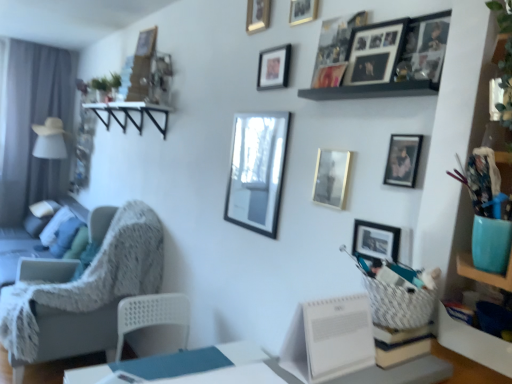
Where is `empty space that is ontop of black wooden shelf at upper center (from a real-world perspective)`? This screenshot has height=384, width=512. empty space that is ontop of black wooden shelf at upper center (from a real-world perspective) is located at coordinates (369, 86).